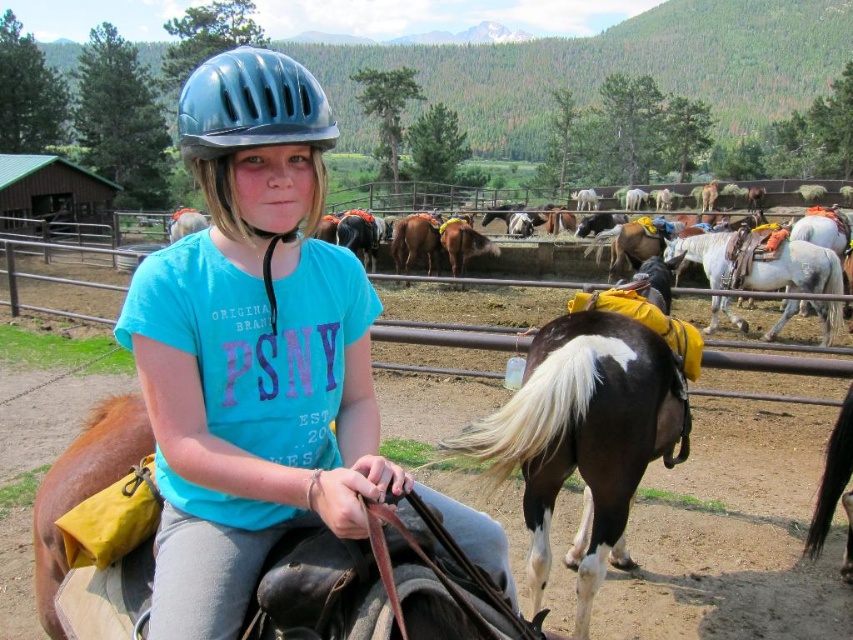
Question: Is white glossy horse at center wider than brown glossy horse at lower right?

Choices:
 (A) no
 (B) yes

Answer: (B)

Question: Estimate the real-world distances between objects in this image. Which object is closer to the matte blue helmet at center?

Choices:
 (A) white glossy horse at center
 (B) matte blue helmet at upper center
 (C) brown glossy horse at lower right
 (D) brown leather saddle at center

Answer: (B)

Question: Which point is farther to the camera?

Choices:
 (A) white glossy horse at center
 (B) brown glossy horse at lower right

Answer: (A)

Question: Observing the image, what is the correct spatial positioning of matte blue helmet at center in reference to matte blue helmet at upper center?

Choices:
 (A) above
 (B) below

Answer: (B)

Question: In this image, where is brown glossy horse at center located relative to brown glossy horse at lower right?

Choices:
 (A) right
 (B) left

Answer: (B)

Question: Which point is farther to the camera?

Choices:
 (A) pos(838,497)
 (B) pos(231,124)
 (C) pos(805,264)

Answer: (C)